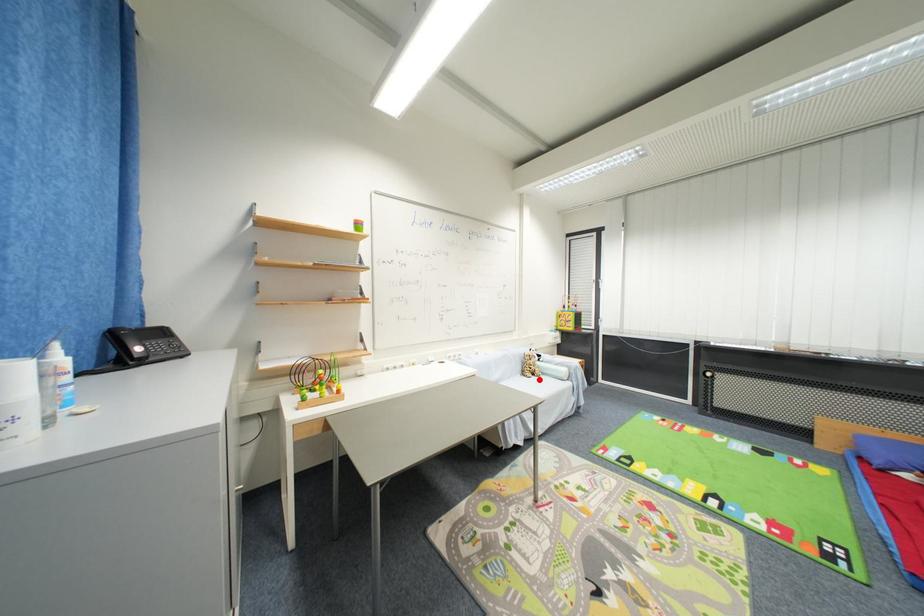
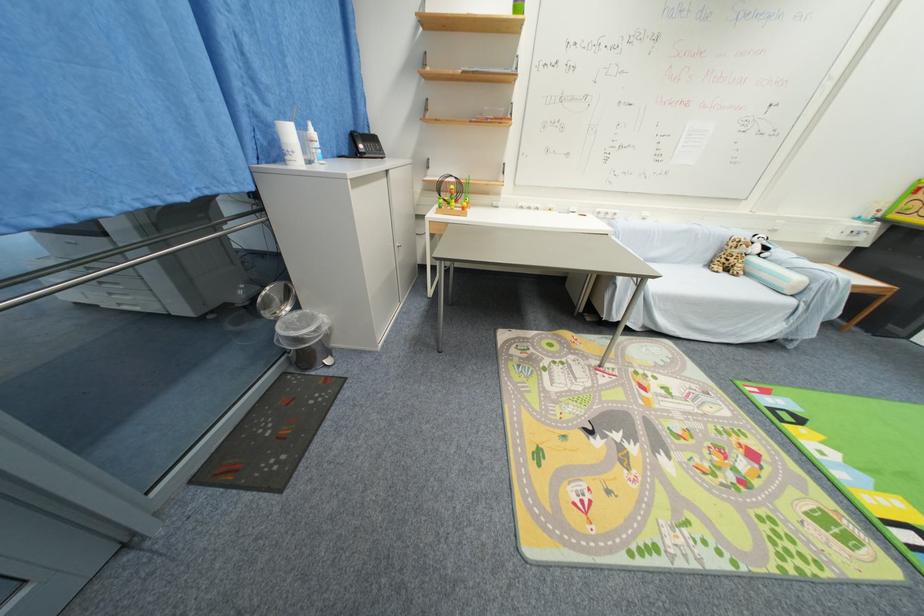
Question: I am providing you with two images of the same scene from different viewpoints. Image1 has a red point marked. In image2, the corresponding 3D location appears at what relative position? Reply with the corresponding letter.

Choices:
 (A) Closer
 (B) Farther

Answer: (A)